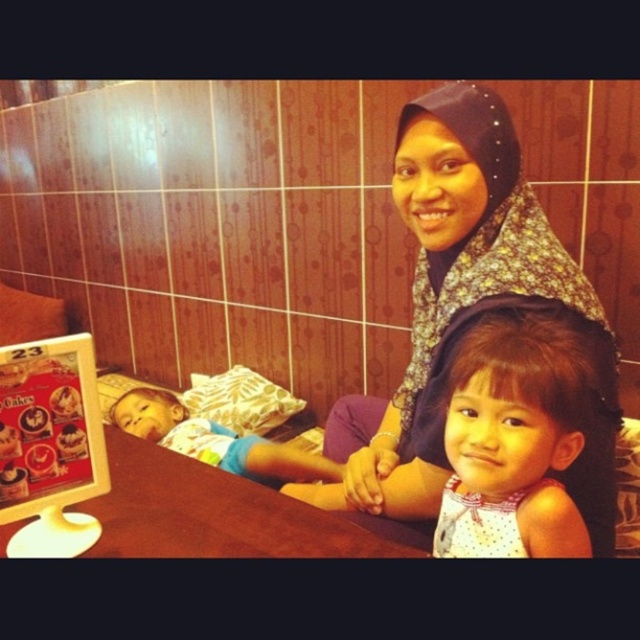
Question: Does patterned fabric hijab at upper center appear over brown wooden table at center?

Choices:
 (A) yes
 (B) no

Answer: (A)

Question: Is patterned fabric hijab at upper center wider than light brown hair at center?

Choices:
 (A) no
 (B) yes

Answer: (B)

Question: Which point is farther to the camera?

Choices:
 (A) (490, 300)
 (B) (284, 508)
 (C) (512, 509)
 (D) (276, 452)

Answer: (D)

Question: Estimate the real-world distances between objects in this image. Which object is farther from the brown wooden table at center?

Choices:
 (A) patterned fabric hijab at upper center
 (B) light blue cotton shirt at left

Answer: (B)

Question: Which object appears farthest from the camera in this image?

Choices:
 (A) patterned fabric hijab at upper center
 (B) light blue cotton shirt at left
 (C) light brown hair at center
 (D) brown wooden table at center

Answer: (B)

Question: Does light brown hair at center appear on the right side of brown wooden table at center?

Choices:
 (A) no
 (B) yes

Answer: (B)